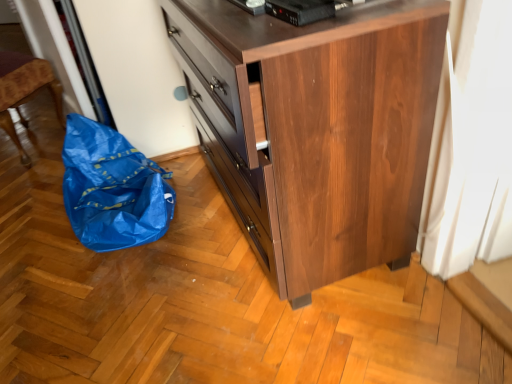
Identify the location of unoccupied region to the right of black plastic device at upper center. The height and width of the screenshot is (384, 512). (376, 8).